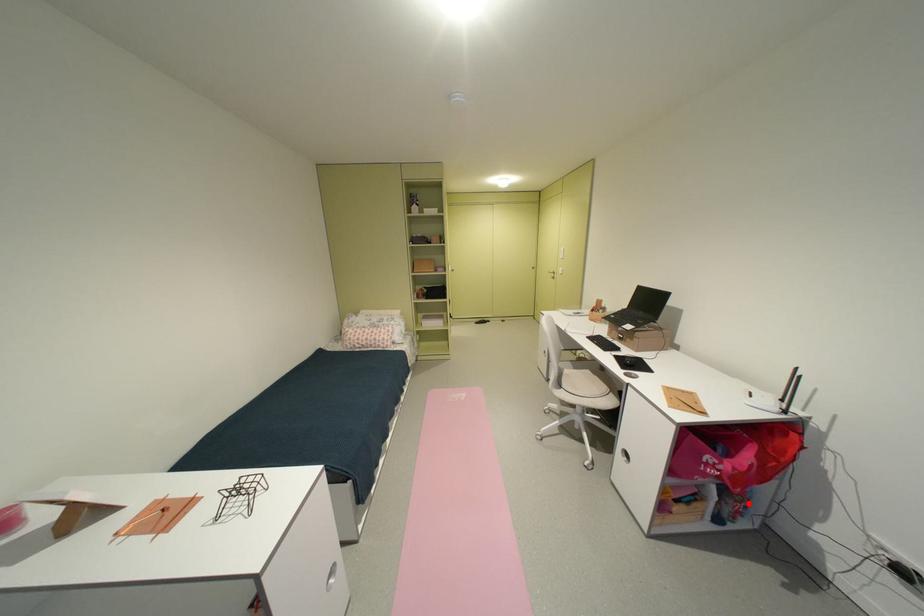
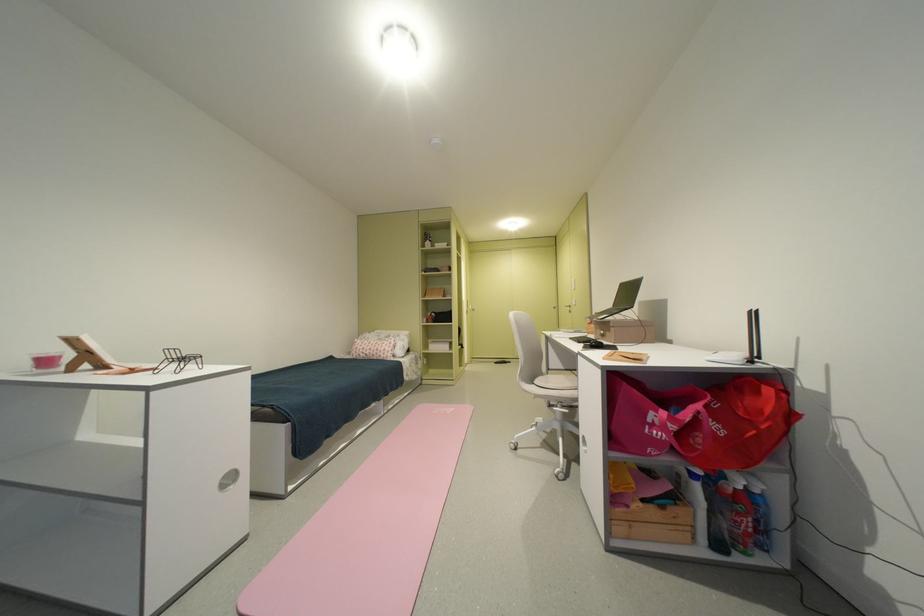
Find the pixel in the second image that matches the highlighted location in the first image.

(755, 519)